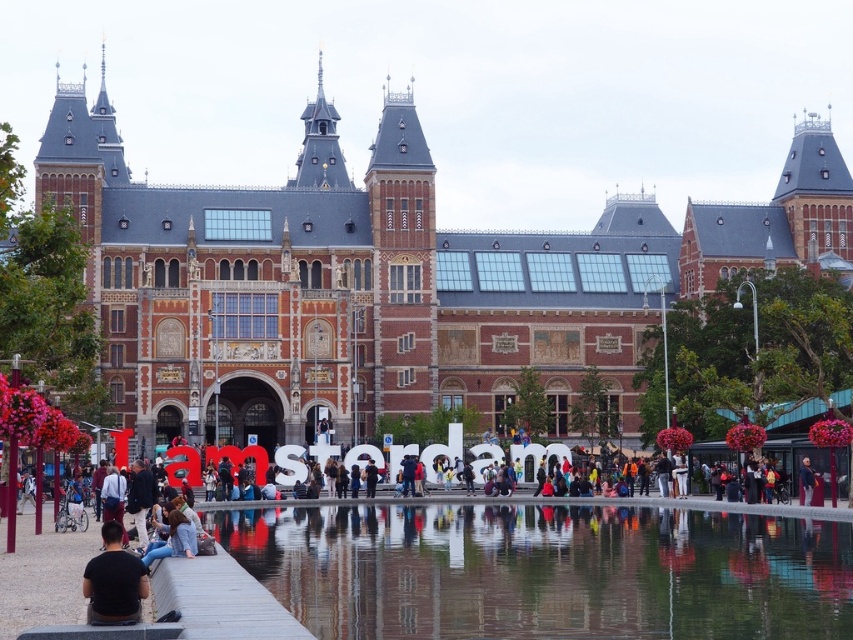
You are standing in front of the grand historic building and want to take a photo of the reflective glass water at center. Where should you position yourself to ensure the water is in the center of your photo?

You should position yourself directly in front of the reflective glass water at center, which is located at point (x=544, y=570), to ensure it is centered in your photo.

Based on the photo, you are standing in front of the historic building and notice two points marked in the scene. The first point is at coordinate point (502, 572) and the second is at point (140, 588). Which of these two points is closer to your current position?

Point (140, 588) is closer to your current position because it is closer to the camera than point (502, 572).